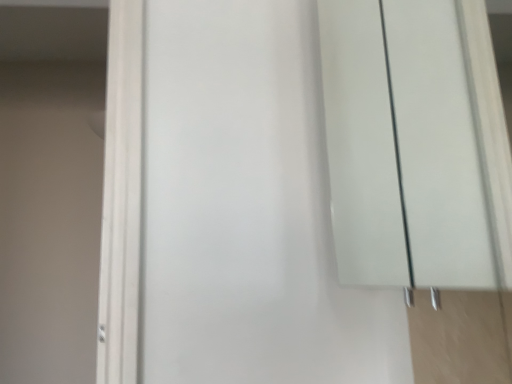
What is the approximate height of white glossy door at right?

white glossy door at right is 25.94 inches tall.

Describe the element at coordinates (402, 146) in the screenshot. I see `white glossy door at right` at that location.

Find the location of a particular element. This screenshot has height=384, width=512. white glossy door at right is located at coordinates (402, 146).

Where is `white glossy door at right`? Image resolution: width=512 pixels, height=384 pixels. white glossy door at right is located at coordinates (402, 146).